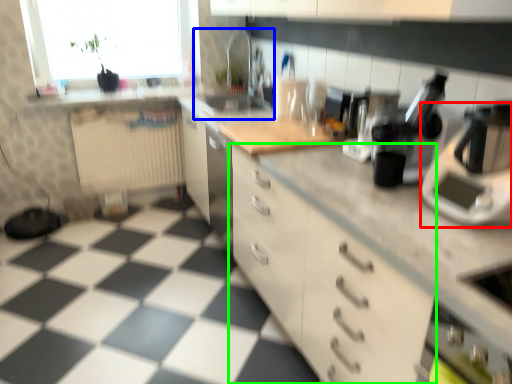
Question: Which object is the farthest from home appliance (highlighted by a red box)? Choose among these: sink (highlighted by a blue box) or cabinetry (highlighted by a green box).

Choices:
 (A) sink
 (B) cabinetry

Answer: (A)